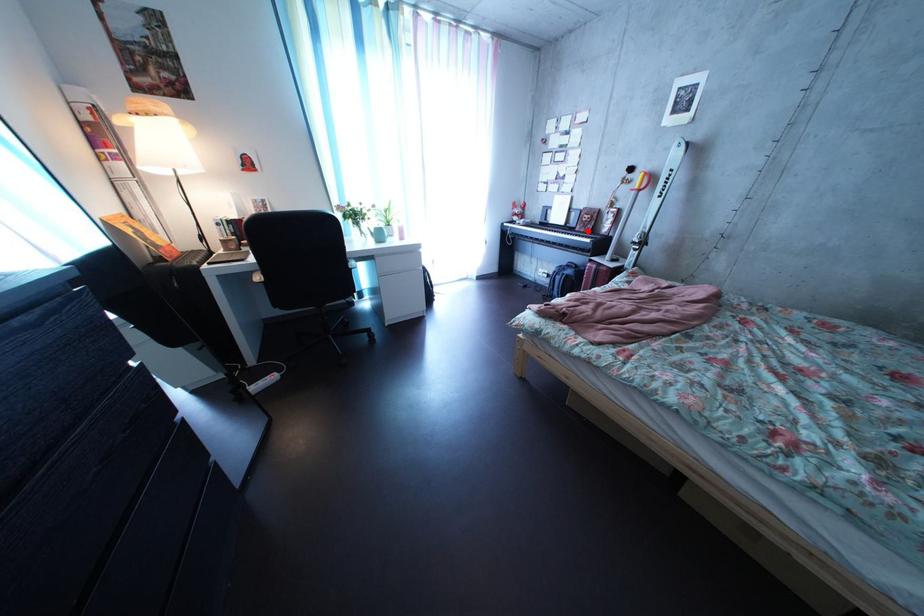
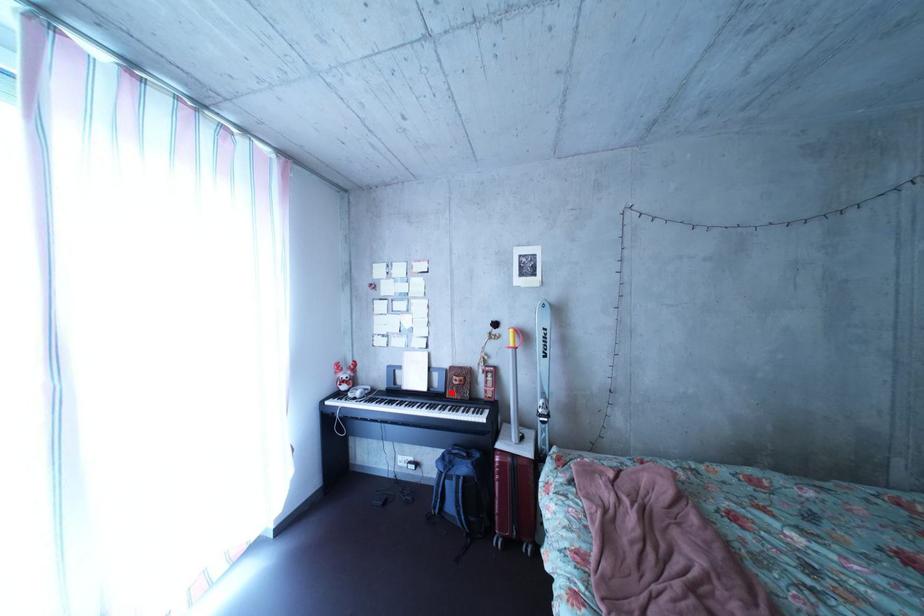
I am providing you with two images of the same scene from different viewpoints. A red point is marked on the first image and another point is marked on the second image. Is the marked point in image1 the same physical position as the marked point in image2?

Yes